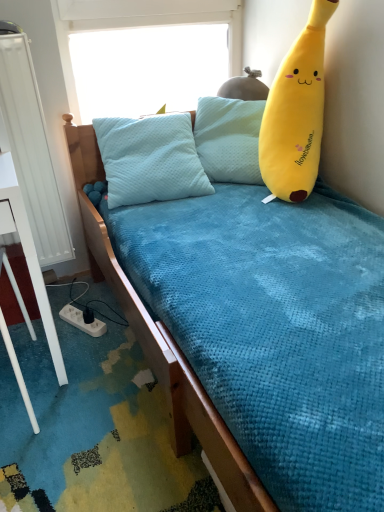
Locate an element on the screen. The width and height of the screenshot is (384, 512). transparent plastic window screen at upper center is located at coordinates (148, 68).

What do you see at coordinates (296, 113) in the screenshot? I see `yellow plush toy at right` at bounding box center [296, 113].

I want to click on white metallic radiator at left, so click(32, 151).

Does transparent plastic window screen at upper center come in front of white metallic radiator at left?

No, transparent plastic window screen at upper center is further to the viewer.

From a real-world perspective, is transparent plastic window screen at upper center over white metallic radiator at left?

Yes.

Does transparent plastic window screen at upper center appear on the left side of white metallic radiator at left?

No.

Considering the points (188, 104) and (14, 110), which point is behind, point (188, 104) or point (14, 110)?

The point (188, 104) is farther from the camera.

Are white metallic radiator at left and white plastic power outlet at lower left beside each other?

There is a gap between white metallic radiator at left and white plastic power outlet at lower left.

Would you say white plastic power outlet at lower left is part of white metallic radiator at left's contents?

Definitely not — white plastic power outlet at lower left is not inside white metallic radiator at left.

From the image's perspective, between white metallic radiator at left and white plastic power outlet at lower left, which one is located above?

white metallic radiator at left appears higher in the image.

Which is more to the right, white metallic radiator at left or white plastic power outlet at lower left?

Positioned to the right is white plastic power outlet at lower left.

Which object is positioned more to the right, yellow plush toy at right or white metallic radiator at left?

yellow plush toy at right.

Does yellow plush toy at right lie in front of white metallic radiator at left?

That is True.

Which of these two, yellow plush toy at right or white metallic radiator at left, stands shorter?

With less height is yellow plush toy at right.

Are yellow plush toy at right and white metallic radiator at left beside each other?

No, yellow plush toy at right is not making contact with white metallic radiator at left.

Does point (187, 40) appear closer or farther from the camera than point (286, 192)?

Point (187, 40) is positioned farther from the camera compared to point (286, 192).

Is transparent plastic window screen at upper center to the left of yellow plush toy at right from the viewer's perspective?

Indeed, transparent plastic window screen at upper center is positioned on the left side of yellow plush toy at right.

From a real-world perspective, is transparent plastic window screen at upper center located higher than yellow plush toy at right?

Yes, from a real-world perspective, transparent plastic window screen at upper center is over yellow plush toy at right

From the image's perspective, which one is positioned higher, transparent plastic window screen at upper center or yellow plush toy at right?

transparent plastic window screen at upper center.

Does white plastic power outlet at lower left have a lesser height compared to white metallic radiator at left?

Indeed, white plastic power outlet at lower left has a lesser height compared to white metallic radiator at left.

Identify the location of power outlet below the white metallic radiator at left (from a real-world perspective). This screenshot has width=384, height=512. (82, 321).

Is white plastic power outlet at lower left located outside white metallic radiator at left?

Indeed, white plastic power outlet at lower left is completely outside white metallic radiator at left.

Is white plastic power outlet at lower left not close to white metallic radiator at left?

No, white plastic power outlet at lower left is not far from white metallic radiator at left.

Which of these two, yellow plush toy at right or white plastic power outlet at lower left, is bigger?

Bigger between the two is yellow plush toy at right.

Who is shorter, yellow plush toy at right or white plastic power outlet at lower left?

white plastic power outlet at lower left.

Are yellow plush toy at right and white plastic power outlet at lower left making contact?

yellow plush toy at right and white plastic power outlet at lower left are clearly separated.

Considering the sizes of objects transparent plastic window screen at upper center and white plastic power outlet at lower left in the image provided, who is thinner, transparent plastic window screen at upper center or white plastic power outlet at lower left?

With smaller width is transparent plastic window screen at upper center.

Which is closer to the camera, (176,101) or (72,319)?

Positioned in front is point (72,319).

Consider the image. Is transparent plastic window screen at upper center aimed at white plastic power outlet at lower left?

No, transparent plastic window screen at upper center does not turn towards white plastic power outlet at lower left.

From the image's perspective, which one is positioned lower, transparent plastic window screen at upper center or white plastic power outlet at lower left?

white plastic power outlet at lower left, from the image's perspective.

There is a white metallic radiator at left. Identify the location of window screen above it (from a real-world perspective). (148, 68).

I want to click on radiator that appears on the left of white plastic power outlet at lower left, so coord(32,151).

Considering their positions, is white metallic radiator at left positioned closer to yellow plush toy at right than transparent plastic window screen at upper center?

Based on the image, transparent plastic window screen at upper center appears to be nearer to yellow plush toy at right.

Looking at the image, which one is located closer to transparent plastic window screen at upper center, yellow plush toy at right or white plastic power outlet at lower left?

The object closer to transparent plastic window screen at upper center is yellow plush toy at right.

Based on their spatial positions, is white metallic radiator at left or transparent plastic window screen at upper center closer to white plastic power outlet at lower left?

white metallic radiator at left is closer to white plastic power outlet at lower left.

From the image, which object appears to be farther from white metallic radiator at left, yellow plush toy at right or white plastic power outlet at lower left?

yellow plush toy at right is positioned further to the anchor white metallic radiator at left.

From the image, which object appears to be farther from white plastic power outlet at lower left, transparent plastic window screen at upper center or yellow plush toy at right?

Among the two, transparent plastic window screen at upper center is located further to white plastic power outlet at lower left.

When comparing their distances from transparent plastic window screen at upper center, does yellow plush toy at right or white metallic radiator at left seem closer?

white metallic radiator at left is positioned closer to the anchor transparent plastic window screen at upper center.

Considering their positions, is white metallic radiator at left positioned further to white plastic power outlet at lower left than yellow plush toy at right?

Based on the image, yellow plush toy at right appears to be further to white plastic power outlet at lower left.

Considering their positions, is white metallic radiator at left positioned closer to transparent plastic window screen at upper center than yellow plush toy at right?

white metallic radiator at left is closer to transparent plastic window screen at upper center.

Where is `radiator between transparent plastic window screen at upper center and white plastic power outlet at lower left vertically`? This screenshot has width=384, height=512. radiator between transparent plastic window screen at upper center and white plastic power outlet at lower left vertically is located at coordinates (32, 151).

The height and width of the screenshot is (512, 384). Identify the location of window screen between white metallic radiator at left and yellow plush toy at right. (148, 68).

Where is `banana between transparent plastic window screen at upper center and white plastic power outlet at lower left in the up-down direction`? banana between transparent plastic window screen at upper center and white plastic power outlet at lower left in the up-down direction is located at coordinates (296, 113).

This screenshot has height=512, width=384. What are the coordinates of `power outlet between white metallic radiator at left and yellow plush toy at right` in the screenshot? It's located at (82, 321).